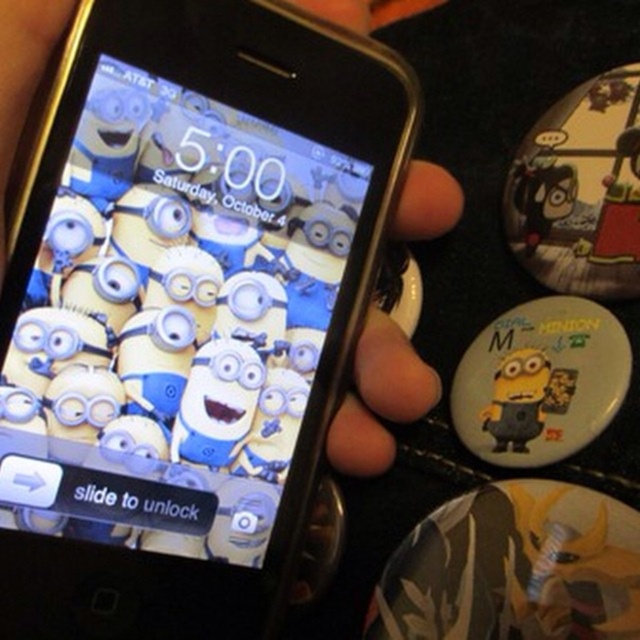
You are organizing a themed birthday party and need to arrange decorations. You have a black plastic smartphone at center and a white matte badge at lower right. According to the image, where should you place the white matte badge relative to the black plastic smartphone?

The black plastic smartphone at center is located above the white matte badge at lower right, so you should place the white matte badge below the black plastic smartphone at center.

You are organizing items on a desk and need to place the black plastic smartphone at center and the white matte badge at lower right. Based on their positions, which item is closer to the left edge of the desk?

The black plastic smartphone at center is closer to the left edge of the desk because it is positioned to the left of the white matte badge at lower right.